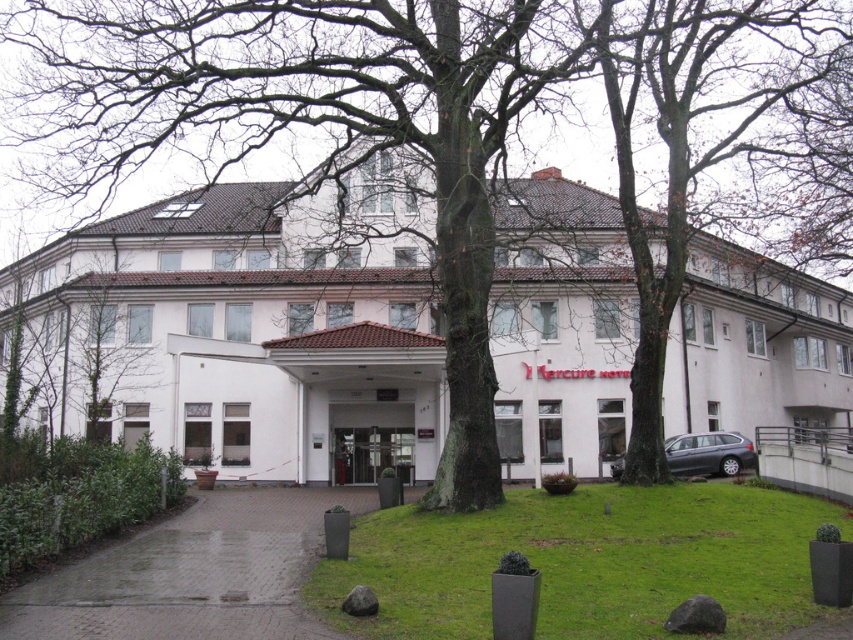
Is white matte building at center positioned before metallic gray car at lower right?

Yes, it is in front of metallic gray car at lower right.

Which is in front, point (589, 280) or point (614, 468)?

Point (614, 468) is in front.

This screenshot has height=640, width=853. I want to click on white matte building at center, so click(x=236, y=337).

Between smooth bark tree at center and metallic gray car at lower right, which one appears on the right side from the viewer's perspective?

From the viewer's perspective, smooth bark tree at center appears more on the right side.

Does smooth bark tree at center have a greater height compared to metallic gray car at lower right?

Indeed, smooth bark tree at center has a greater height compared to metallic gray car at lower right.

Image resolution: width=853 pixels, height=640 pixels. Describe the element at coordinates (689, 141) in the screenshot. I see `smooth bark tree at center` at that location.

Locate an element on the screen. smooth bark tree at center is located at coordinates (689, 141).

Can you confirm if white matte building at center is thinner than smooth bark tree at center?

Incorrect, white matte building at center's width is not less than smooth bark tree at center's.

Locate an element on the screen. white matte building at center is located at coordinates (236, 337).

Image resolution: width=853 pixels, height=640 pixels. I want to click on white matte building at center, so click(x=236, y=337).